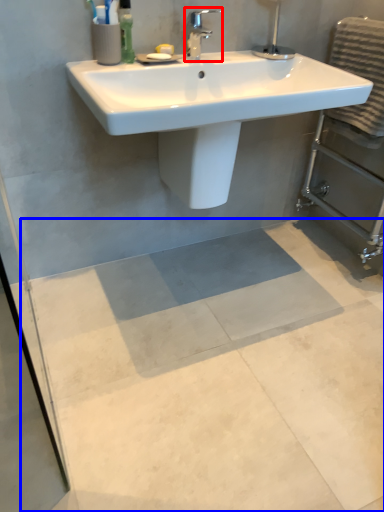
Question: Among these objects, which one is nearest to the camera, tap (highlighted by a red box) or concrete (highlighted by a blue box)?

Choices:
 (A) tap
 (B) concrete

Answer: (B)